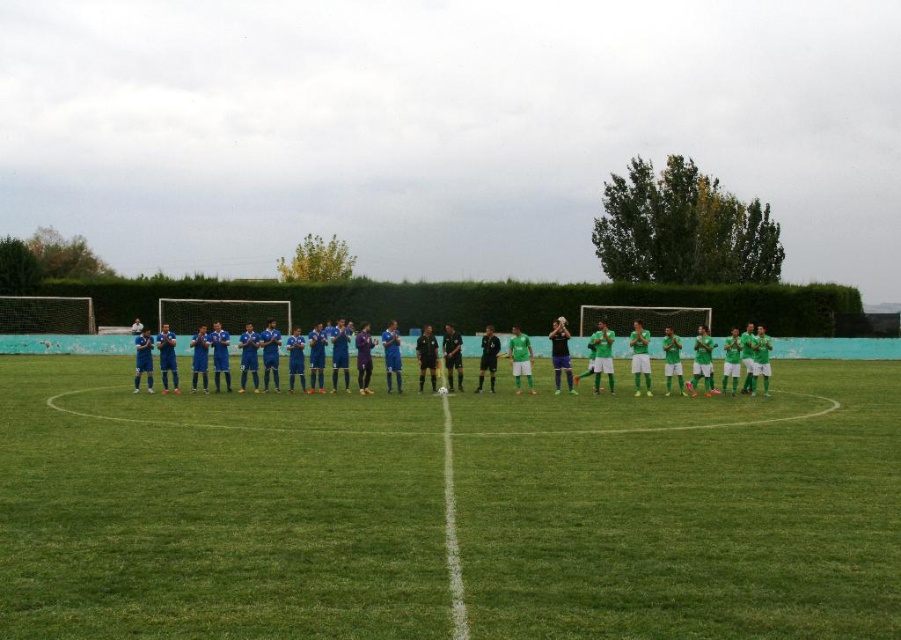
Can you confirm if green grass football field at center is wider than blue matte soccer team at center?

No.

How distant is green grass football field at center from blue matte soccer team at center?

green grass football field at center is 8.11 meters away from blue matte soccer team at center.

The height and width of the screenshot is (640, 901). In order to click on green grass football field at center in this screenshot , I will do `click(215, 512)`.